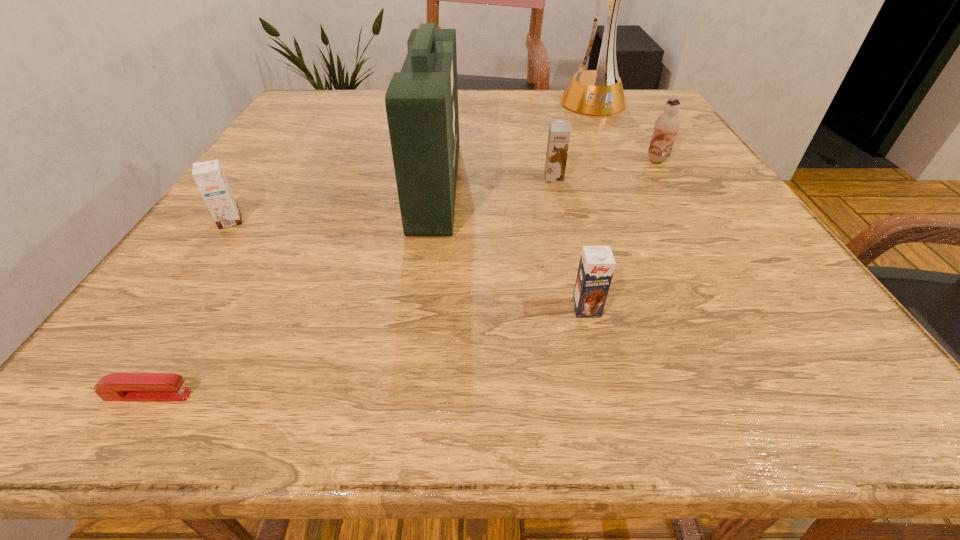
At what (x,y) coordinates should I click in order to perform the action: click on stapler present at the left edge. Please return your answer as a coordinate pair (x, y). This screenshot has width=960, height=540. Looking at the image, I should click on (117, 386).

The width and height of the screenshot is (960, 540). I want to click on trophy that is at the right edge, so click(599, 92).

This screenshot has height=540, width=960. In order to click on chocolate milk that is at the right edge in this screenshot , I will do `click(666, 127)`.

Locate an element on the screen. This screenshot has width=960, height=540. object present at the near left corner is located at coordinates (117, 386).

Locate an element on the screen. object that is at the far right corner is located at coordinates (599, 92).

In the image, there is a desktop. In order to click on vacant space at the far edge in this screenshot , I will do `click(358, 120)`.

Where is `blank space at the near edge of the desktop`? The image size is (960, 540). blank space at the near edge of the desktop is located at coordinates point(253,372).

Locate an element on the screen. free region at the left edge of the desktop is located at coordinates (281, 239).

The width and height of the screenshot is (960, 540). Find the location of `free region at the right edge of the desktop`. free region at the right edge of the desktop is located at coordinates (794, 278).

You are a GUI agent. You are given a task and a screenshot of the screen. Output one action in this format:
    pyautogui.click(x=<x>, y=<y>)
    Task: Click on the free location at the far left corner
    Image resolution: width=960 pixels, height=540 pixels.
    Given the screenshot: What is the action you would take?
    pyautogui.click(x=362, y=90)